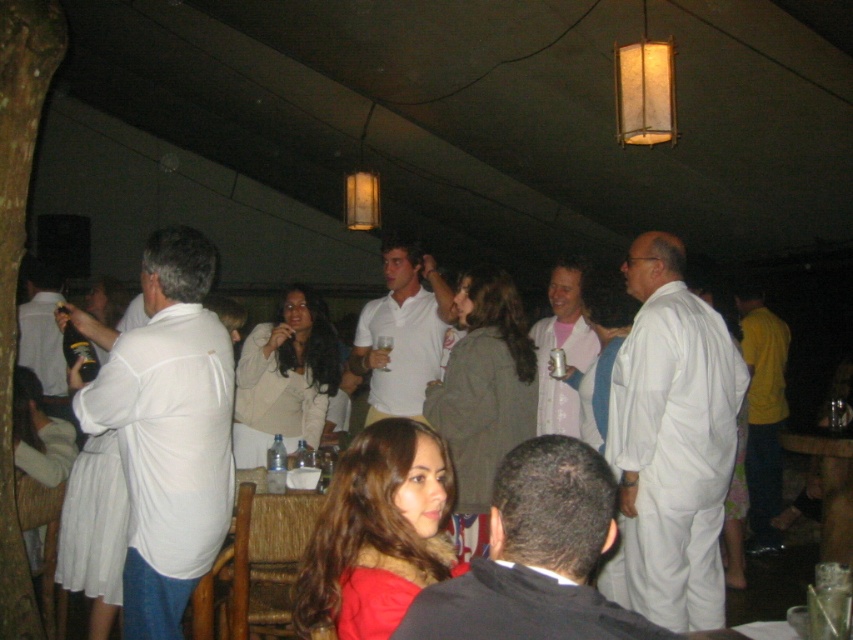
You are at the entrance of the tent and want to find the matte gray jacket at center. Based on the coordinates provided, in which direction should you look to locate it?

The matte gray jacket at center is located at coordinates point (483, 396), so you should look towards the center of the tent to find it.

In the scene shown: You are a photographer at the event and want to ensure both the black matte suit at center and the yellow cotton shirt at right are clearly visible in your photo. Which clothing item should you focus on first to ensure proper exposure, considering their sizes?

The black matte suit at center is smaller in size compared to the yellow cotton shirt at right. To ensure proper exposure, focus on the smaller black matte suit at center first, as its smaller size may require more precise adjustment to capture details without overexposing the larger yellow cotton shirt at right.